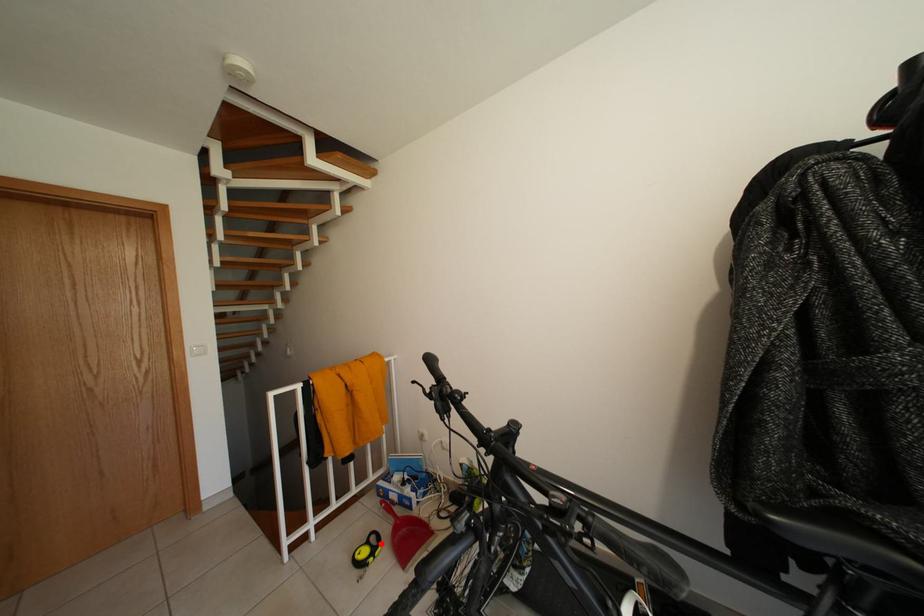
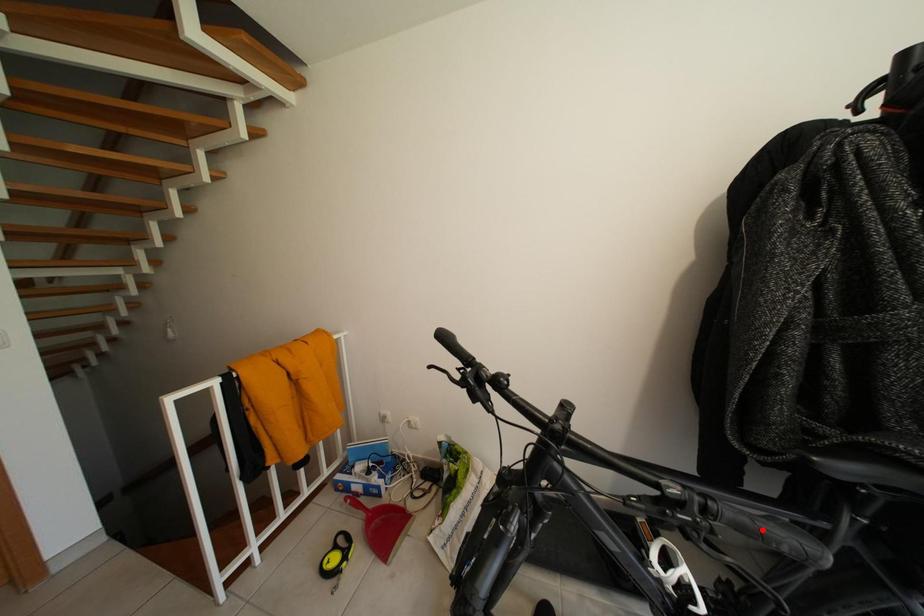
I am providing you with two images of the same scene from different viewpoints. A red point is marked on the first image and another point is marked on the second image. Is the red point in image1 aligned with the point shown in image2?

No